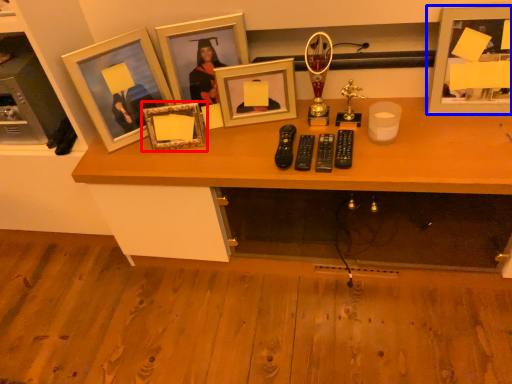
Question: Which point is closer to the camera, picture frame (highlighted by a red box) or picture frame (highlighted by a blue box)?

Choices:
 (A) picture frame
 (B) picture frame

Answer: (B)